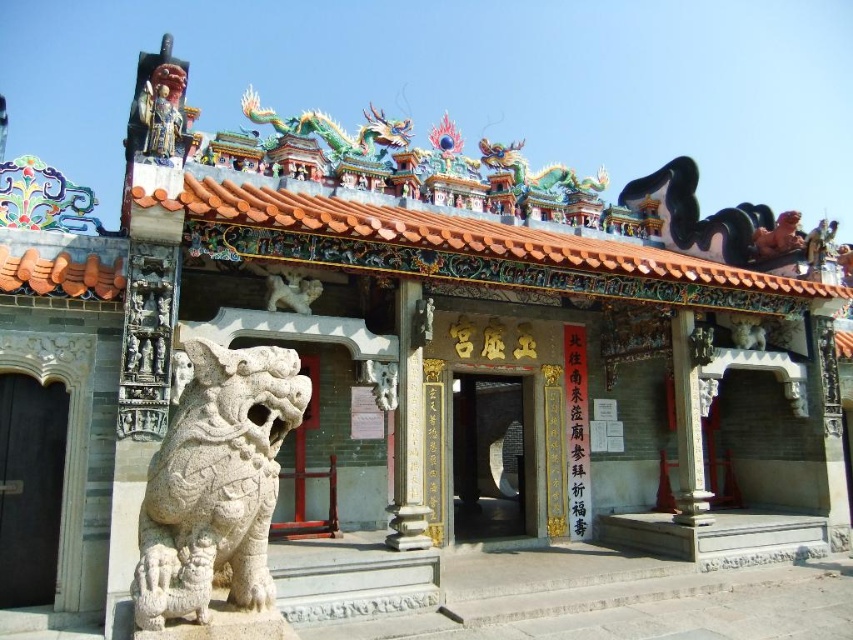
Question: Estimate the real-world distances between objects in this image. Which object is farther from the dark gray stone door at center?

Choices:
 (A) matte painted wood statue at upper left
 (B) white stone lion at lower left
 (C) black wood door at lower left

Answer: (B)

Question: Is black wood door at lower left smaller than matte painted wood statue at upper left?

Choices:
 (A) yes
 (B) no

Answer: (A)

Question: Is white stone lion at lower left behind matte painted wood statue at upper left?

Choices:
 (A) yes
 (B) no

Answer: (B)

Question: Which object appears closest to the camera in this image?

Choices:
 (A) black wood door at lower left
 (B) matte painted wood statue at upper left
 (C) dark gray stone door at center

Answer: (A)

Question: Which of the following is the closest to the observer?

Choices:
 (A) matte painted wood statue at upper left
 (B) white stone lion at lower left
 (C) black wood door at lower left

Answer: (B)

Question: Is white stone lion at lower left above dark gray stone door at center?

Choices:
 (A) yes
 (B) no

Answer: (A)